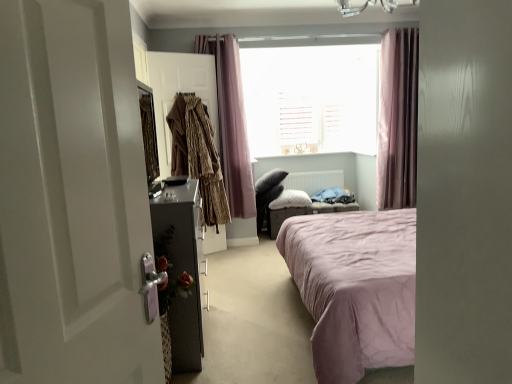
Question: Is leopard print coat at left, positioned as the first clothing in right-to-left order, with pink fabric curtain at upper center, the 2th curtain viewed from the right?

Choices:
 (A) yes
 (B) no

Answer: (B)

Question: Is leopard print coat at left, positioned as the first clothing in right-to-left order, not inside pink fabric curtain at upper center, which is counted as the 1th curtain, starting from the left?

Choices:
 (A) no
 (B) yes

Answer: (B)

Question: Is leopard print coat at left, positioned as the first clothing in right-to-left order, surrounding pink fabric curtain at upper center, the 2th curtain viewed from the right?

Choices:
 (A) no
 (B) yes

Answer: (A)

Question: Is leopard print coat at left, positioned as the first clothing in right-to-left order, facing towards pink fabric curtain at upper center, which is counted as the 1th curtain, starting from the left?

Choices:
 (A) no
 (B) yes

Answer: (A)

Question: From the image's perspective, is leopard print coat at left, positioned as the first clothing in right-to-left order, beneath pink fabric curtain at upper center, which is counted as the 1th curtain, starting from the left?

Choices:
 (A) no
 (B) yes

Answer: (B)

Question: Visually, is pink fabric curtain at upper center, which is counted as the 1th curtain, starting from the left, positioned to the left or to the right of pink fabric ottoman at center?

Choices:
 (A) left
 (B) right

Answer: (A)

Question: Which is correct: pink fabric curtain at upper center, which is counted as the 1th curtain, starting from the left, is inside pink fabric ottoman at center, or outside of it?

Choices:
 (A) inside
 (B) outside

Answer: (B)

Question: From the image's perspective, is pink fabric curtain at upper center, which is counted as the 1th curtain, starting from the left, above or below pink fabric ottoman at center?

Choices:
 (A) above
 (B) below

Answer: (A)

Question: Is point (246, 193) positioned closer to the camera than point (273, 211)?

Choices:
 (A) closer
 (B) farther

Answer: (A)

Question: Based on their positions, is fluffy white pillow at center located to the left or right of pink fabric ottoman at center?

Choices:
 (A) left
 (B) right

Answer: (A)

Question: Would you say fluffy white pillow at center is inside or outside pink fabric ottoman at center?

Choices:
 (A) inside
 (B) outside

Answer: (B)

Question: In the image, is fluffy white pillow at center positioned in front of or behind pink fabric ottoman at center?

Choices:
 (A) behind
 (B) front

Answer: (A)

Question: Looking at the image, does fluffy white pillow at center seem bigger or smaller compared to pink fabric ottoman at center?

Choices:
 (A) small
 (B) big

Answer: (A)

Question: From the image's perspective, relative to white wooden blinds at center, is pink fabric ottoman at center above or below?

Choices:
 (A) below
 (B) above

Answer: (A)

Question: Relative to white wooden blinds at center, is pink fabric ottoman at center in front or behind?

Choices:
 (A) behind
 (B) front

Answer: (B)